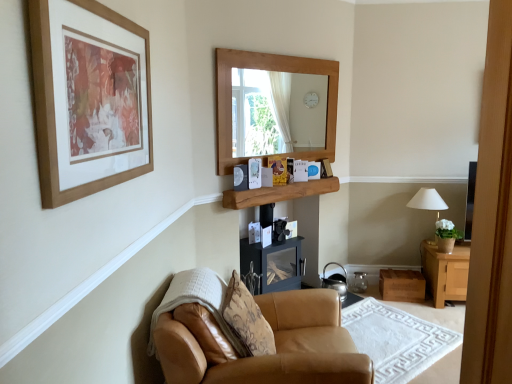
Question: Is tan leather armchair at lower center wider or thinner than patterned fabric pillow at lower center?

Choices:
 (A) wide
 (B) thin

Answer: (A)

Question: Considering the relative positions of tan leather armchair at lower center and patterned fabric pillow at lower center in the image provided, is tan leather armchair at lower center to the left or to the right of patterned fabric pillow at lower center?

Choices:
 (A) left
 (B) right

Answer: (B)

Question: Which object is positioned farthest from the wooden picture frame at upper left?

Choices:
 (A) patterned fabric pillow at lower center
 (B) shiny metallic kettle at lower center
 (C) green leafy plant in terracotta pot at right
 (D) white fabric lampshade at right
 (E) wooden shelf at center

Answer: (D)

Question: Estimate the real-world distances between objects in this image. Which object is farther from the wooden picture frame at upper left?

Choices:
 (A) green leafy plant in terracotta pot at right
 (B) tan leather armchair at lower center
 (C) leather armchair at lower left
 (D) shiny metallic kettle at lower center
 (E) white fabric lampshade at right

Answer: (E)